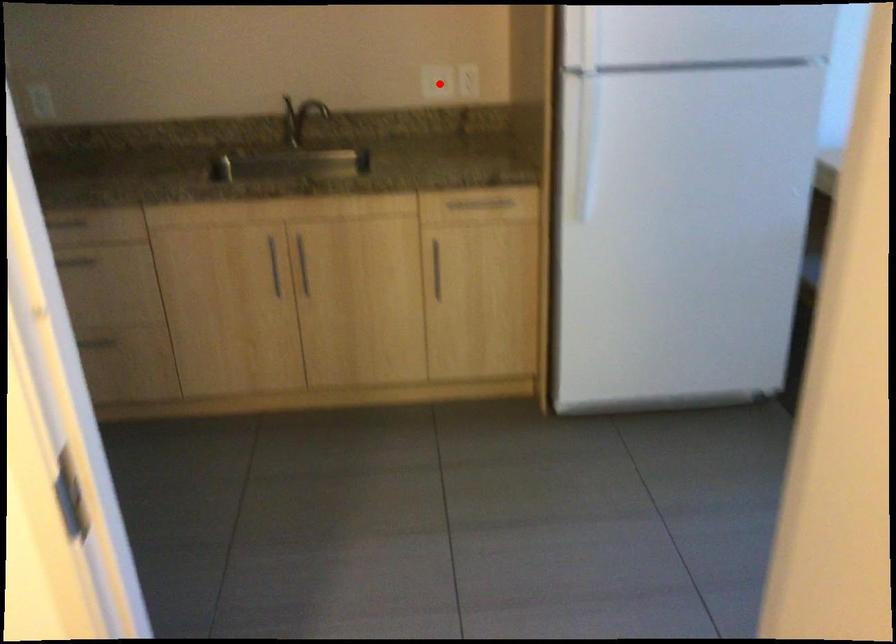
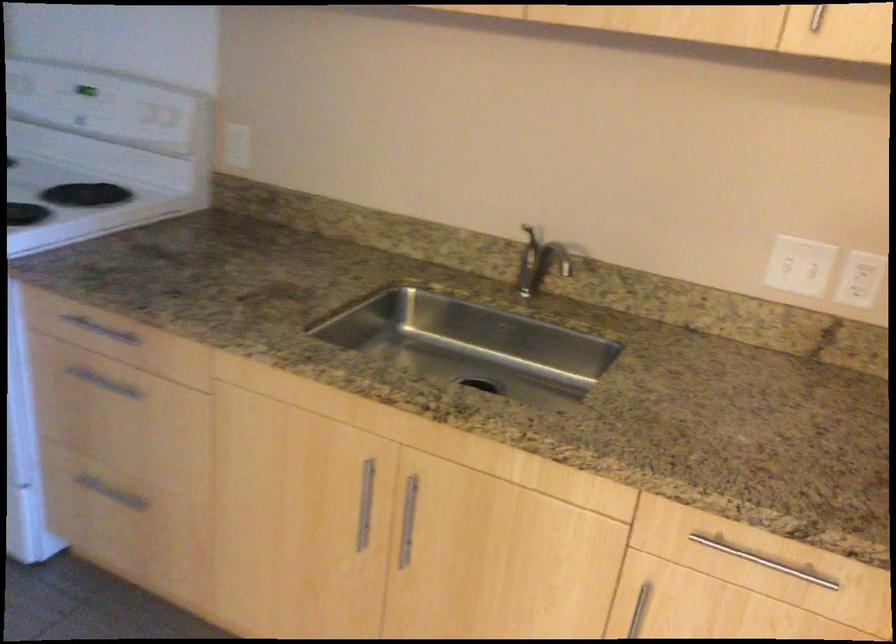
Question: I am providing you with two images of the same scene from different viewpoints. A red point is shown in image1. For the corresponding object point in image2, is it positioned nearer or farther from the camera?

Choices:
 (A) Nearer
 (B) Farther

Answer: (A)